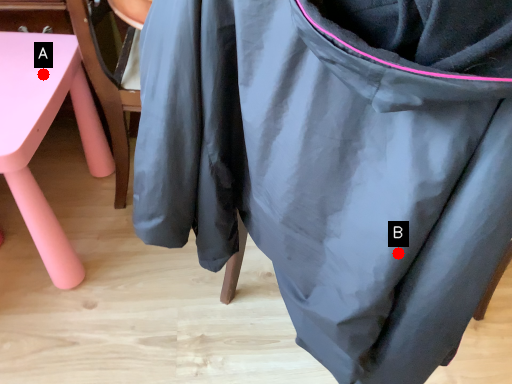
Question: Two points are circled on the image, labeled by A and B beside each circle. Which point is farther to the camera?

Choices:
 (A) A is further
 (B) B is further

Answer: (A)